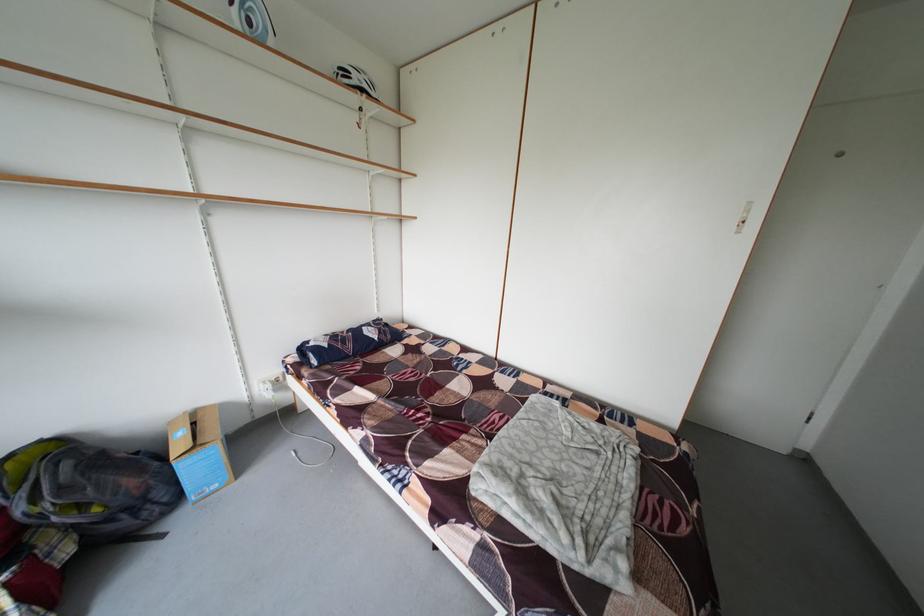
Find where to lift the blue and white helmet. Please return your answer as a coordinate pair (x, y).

(252, 20)